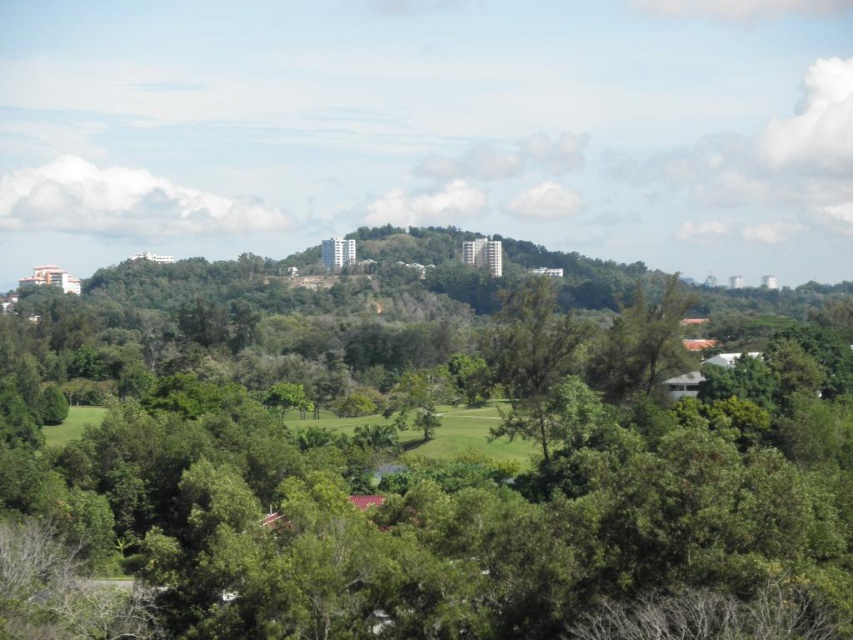
You are planning to set up a small tent in the green grassy field at center. Considering the size of the green leafy tree at center, will the tree provide enough shade for the tent during midday?

The green leafy tree at center has a larger width than the green grassy field at center, so it should provide sufficient shade for the tent during midday.

You are standing in the middle of the green grassy field at center and want to walk towards the green leafy tree at center. Which direction should you head?

The green leafy tree at center is positioned on the left side of green grassy field at center, so you should head to the left.